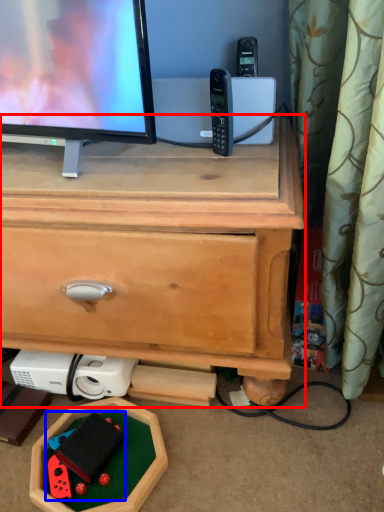
Question: Among these objects, which one is farthest to the camera, chest of drawers (highlighted by a red box) or toy (highlighted by a blue box)?

Choices:
 (A) chest of drawers
 (B) toy

Answer: (B)